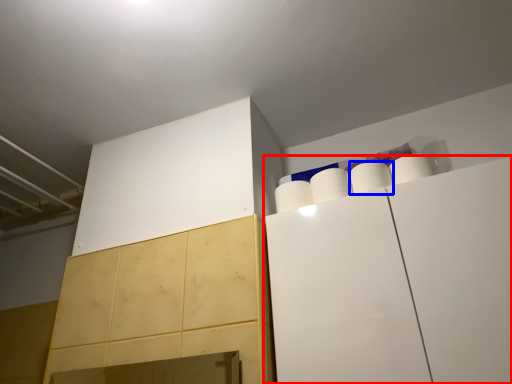
Question: Which object is further to the camera taking this photo, cabinetry (highlighted by a red box) or paper towel (highlighted by a blue box)?

Choices:
 (A) cabinetry
 (B) paper towel

Answer: (B)